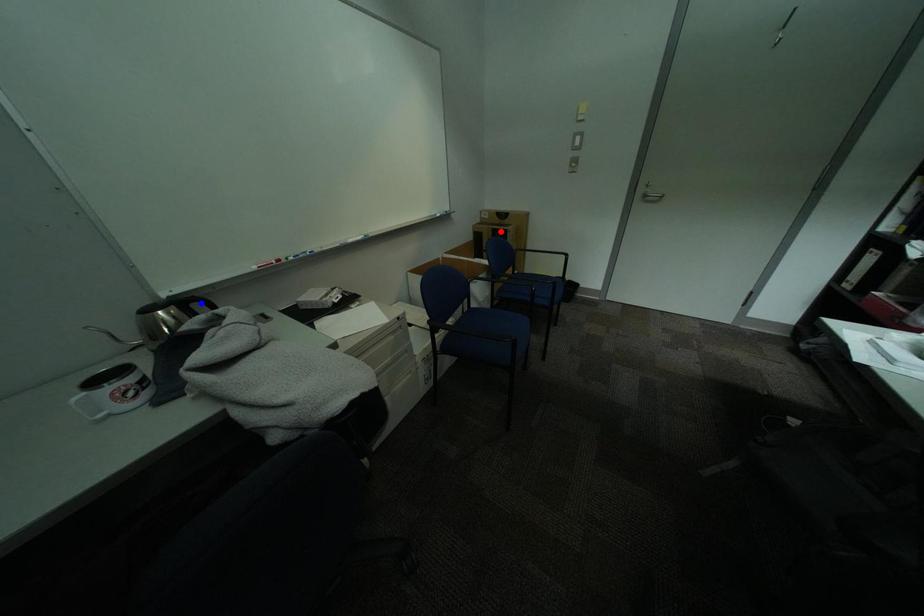
Question: In the image, two points are highlighted. Which point is nearer to the camera? Reply with the corresponding letter.

Choices:
 (A) blue point
 (B) red point

Answer: (A)